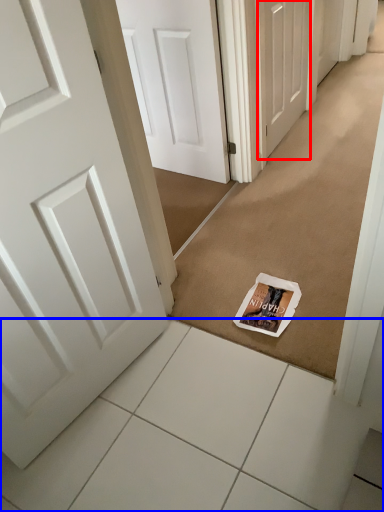
Question: Among these objects, which one is nearest to the camera, door (highlighted by a red box) or tile (highlighted by a blue box)?

Choices:
 (A) door
 (B) tile

Answer: (B)